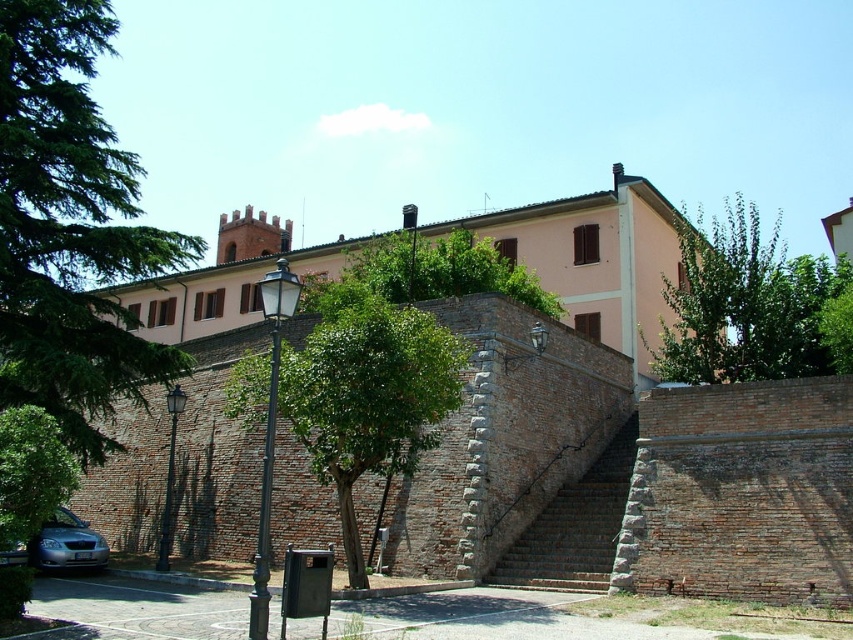
You are an architect planning to add a decorative fence between the green leafy tree at upper center and the brick stairs at center. Considering their widths, which object should the fence be placed closer to to ensure it doesn not block the narrower one?

The brick stairs at center are narrower than the green leafy tree at upper center. The fence should be placed closer to the brick stairs at center to avoid blocking the narrower structure.

Consider the image. You are standing at the entrance of the historic building and notice a green leafy tree at lower left and a silver metallic car at lower left. From your vantage point, which of these two objects is positioned more to the right?

The green leafy tree at lower left is positioned more to the right compared to the silver metallic car at lower left.